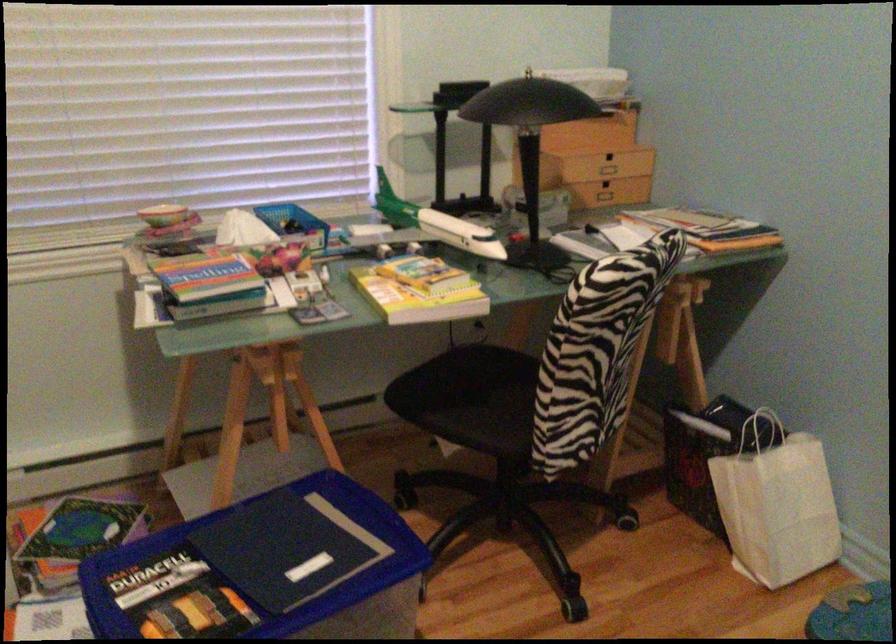
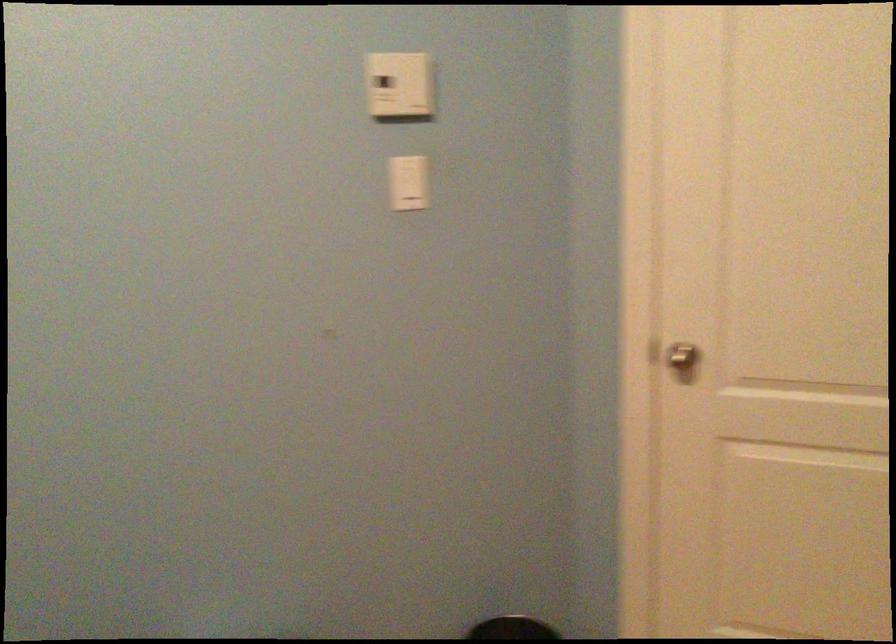
Question: How did the camera likely rotate?

Choices:
 (A) Left
 (B) Right
 (C) Up
 (D) Down

Answer: (B)